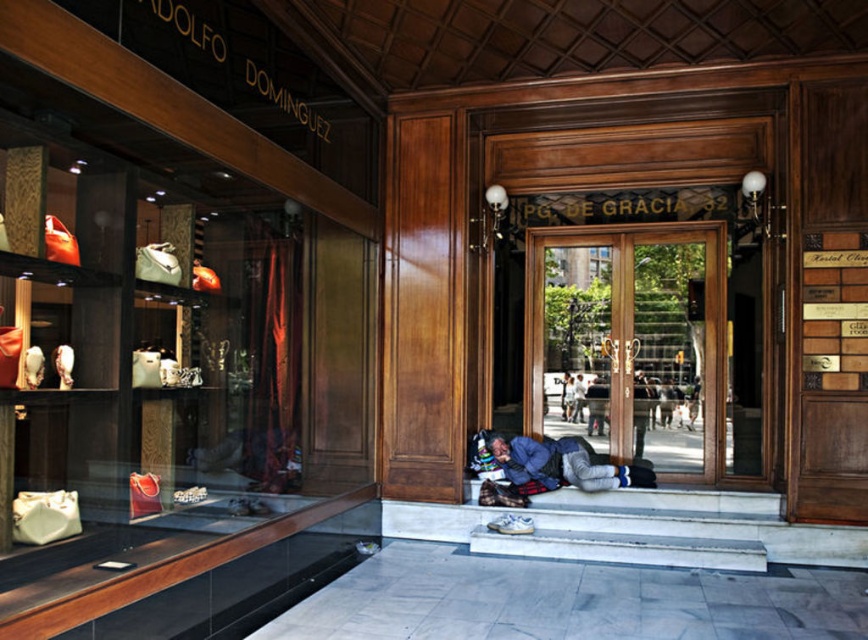
You are a delivery person approaching the entrance of Adolfo Dominguez store. You need to place a package between the two points marked as point (540, 371) and point (579, 465). Which point should you use as the back reference to ensure the package is placed correctly?

Point (540, 371) is behind point (579, 465), so you should use point (540, 371) as the back reference to ensure the package is placed correctly between them.

You are a delivery person trying to enter the store through the wooden door at center. There is a blue denim jacket at lower center blocking your path. Can you step around it to reach the door?

Answer: The wooden door at center is bigger than blue denim jacket at lower center, so yes, you can step around the blue denim jacket at lower center to reach the wooden door at center since the jacket is smaller and less obstructive.